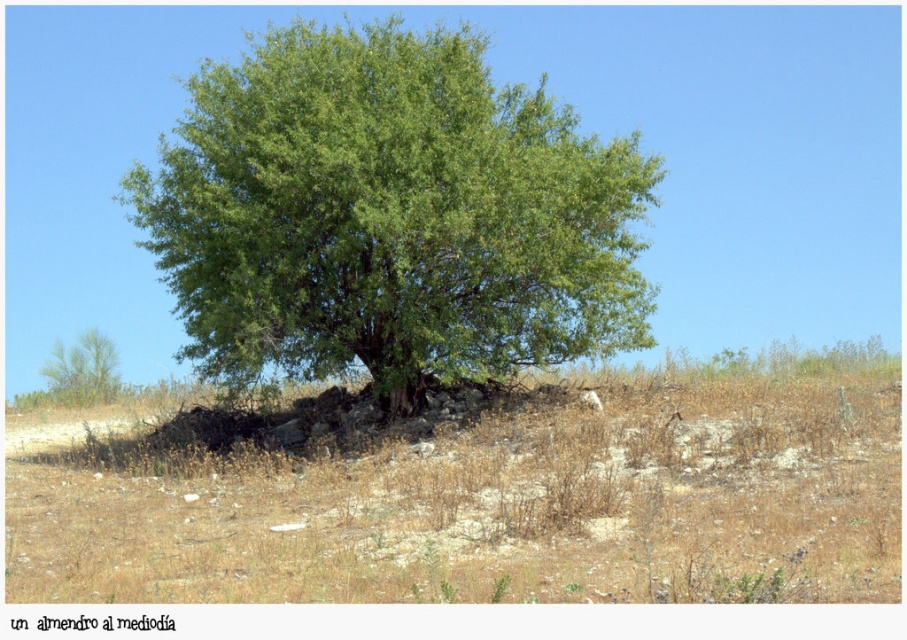
Question: Among these points, which one is farthest from the camera?

Choices:
 (A) (113, 385)
 (B) (203, 257)

Answer: (A)

Question: Does green leafy tree at center have a larger size compared to green leafy tree at lower left?

Choices:
 (A) yes
 (B) no

Answer: (A)

Question: Can you confirm if green leafy tree at center is positioned to the left of green leafy tree at lower left?

Choices:
 (A) yes
 (B) no

Answer: (B)

Question: Estimate the real-world distances between objects in this image. Which object is farther from the brown dry grass at center?

Choices:
 (A) green leafy tree at lower left
 (B) green leafy tree at center

Answer: (A)

Question: Which of the following is the farthest from the observer?

Choices:
 (A) (493, 118)
 (B) (814, 589)

Answer: (A)

Question: Does green leafy tree at center have a lesser width compared to green leafy tree at lower left?

Choices:
 (A) no
 (B) yes

Answer: (A)